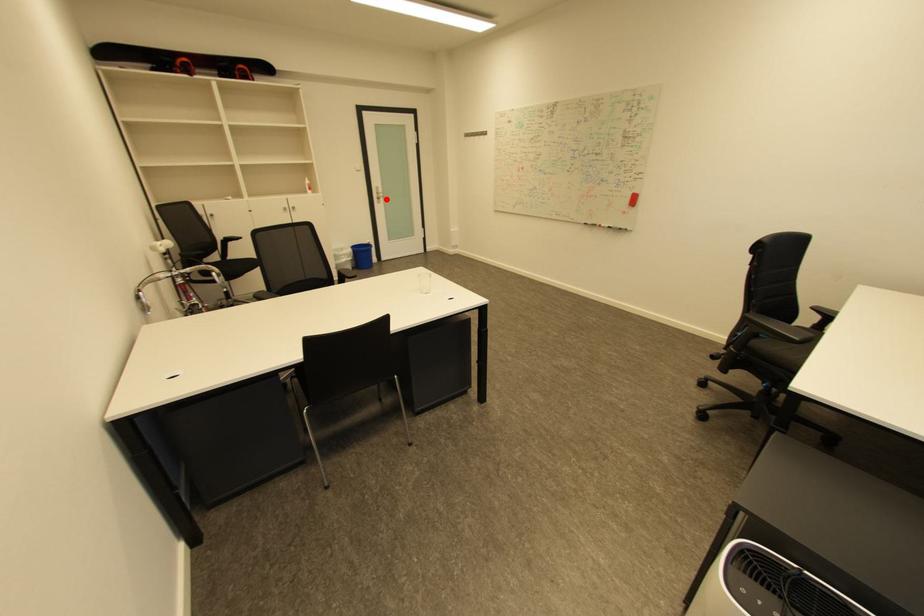
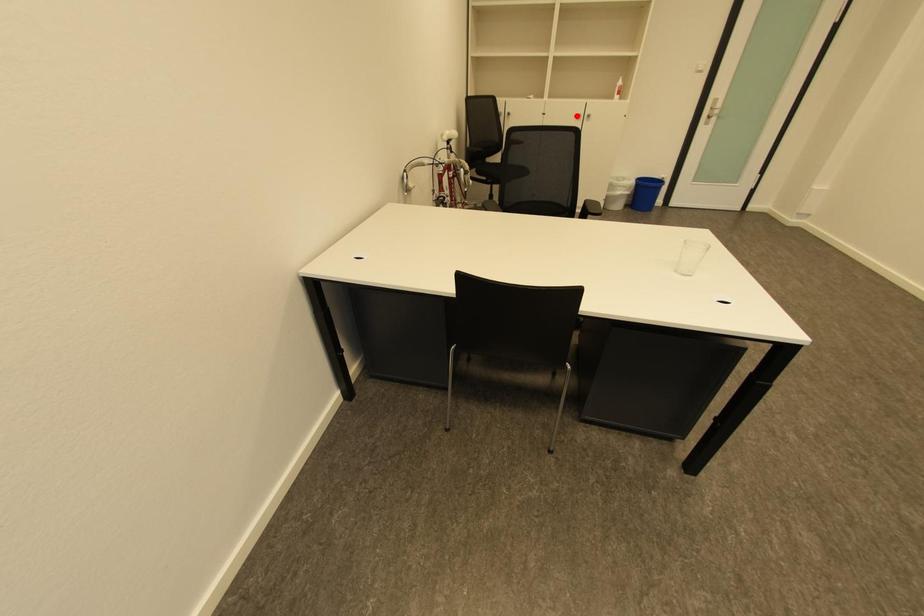
I am providing you with two images of the same scene from different viewpoints. A red point is marked on the first image and another point is marked on the second image. Is the marked point in image1 the same physical position as the marked point in image2?

No